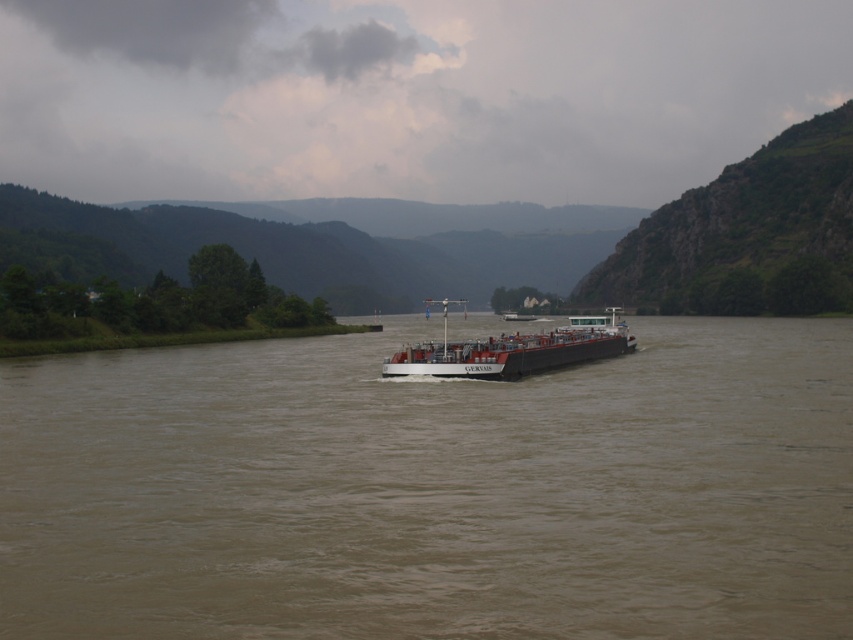
Question: Does brown matte river at center have a lesser width compared to white matte barge at center?

Choices:
 (A) yes
 (B) no

Answer: (B)

Question: Does brown matte river at center appear under white matte barge at center?

Choices:
 (A) no
 (B) yes

Answer: (B)

Question: Which object appears closest to the camera in this image?

Choices:
 (A) brown matte river at center
 (B) white matte barge at center

Answer: (A)

Question: Which object appears farthest from the camera in this image?

Choices:
 (A) brown matte river at center
 (B) white matte barge at center

Answer: (B)

Question: Does brown matte river at center appear under white matte barge at center?

Choices:
 (A) yes
 (B) no

Answer: (A)

Question: Which point is closer to the camera?

Choices:
 (A) white matte barge at center
 (B) brown matte river at center

Answer: (B)